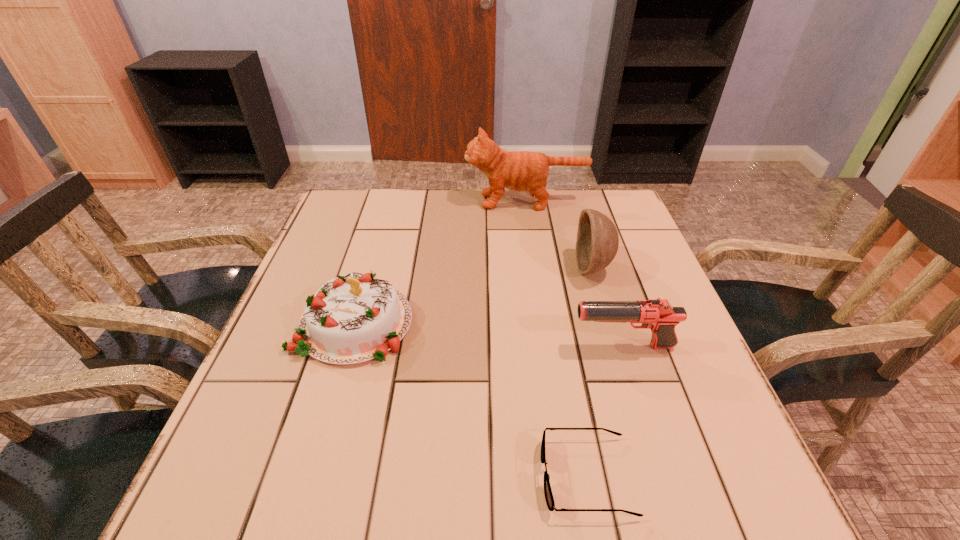
At what (x,y) coordinates should I click in order to perform the action: click on the tallest object. Please return your answer as a coordinate pair (x, y). The width and height of the screenshot is (960, 540). Looking at the image, I should click on (520, 171).

Where is `cat`? The width and height of the screenshot is (960, 540). cat is located at coordinates (520, 171).

Identify the location of the fourth shortest object. This screenshot has width=960, height=540. (597, 242).

Image resolution: width=960 pixels, height=540 pixels. Find the location of `cake`. cake is located at coordinates (353, 318).

Find the location of a particular element. Image resolution: width=960 pixels, height=540 pixels. gun is located at coordinates (659, 315).

This screenshot has height=540, width=960. I want to click on the nearest object, so click(x=549, y=498).

The height and width of the screenshot is (540, 960). What are the coordinates of `spectacles` in the screenshot? It's located at (549, 498).

The image size is (960, 540). I want to click on vacant area situated 0.180m on the face of the tallest object, so click(x=406, y=201).

Where is `blank area located on the face of the tallest object`? The width and height of the screenshot is (960, 540). blank area located on the face of the tallest object is located at coordinates (353, 201).

Locate an element on the screen. free space located 0.050m on the face of the tallest object is located at coordinates pos(449,201).